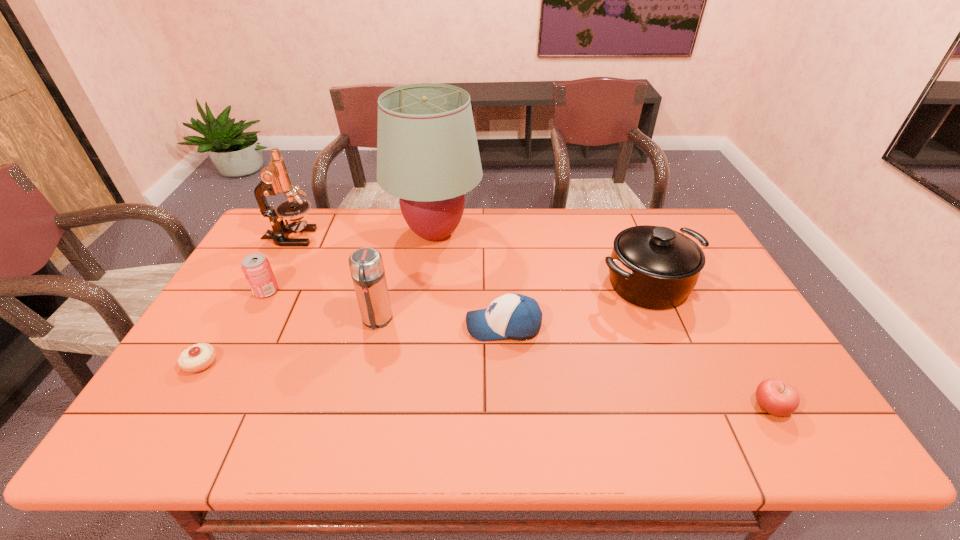
Find the location of `free location located 0.130m on the left of the lampshade`. free location located 0.130m on the left of the lampshade is located at coordinates (349, 233).

Where is `free location located 0.380m at the eyepiece of the seventh shortest object`? Image resolution: width=960 pixels, height=540 pixels. free location located 0.380m at the eyepiece of the seventh shortest object is located at coordinates (431, 237).

This screenshot has height=540, width=960. I want to click on vacant space located 0.100m with a handle on the side of the thermos bottle, so click(366, 365).

At what (x,y) coordinates should I click in order to perform the action: click on vacant space located 0.160m on the left of the saucepan. Please return your answer as a coordinate pair (x, y). Looking at the image, I should click on (541, 284).

Locate an element on the screen. free location located on the back of the soda can is located at coordinates (279, 266).

What are the coordinates of `vacant space located on the front-facing side of the sixth tallest object` in the screenshot? It's located at (325, 326).

Where is `free space located 0.070m on the front-facing side of the sixth tallest object`? free space located 0.070m on the front-facing side of the sixth tallest object is located at coordinates (440, 326).

Locate an element on the screen. This screenshot has width=960, height=540. vacant area situated on the front-facing side of the sixth tallest object is located at coordinates (355, 326).

The height and width of the screenshot is (540, 960). I want to click on vacant space located on the left of the nearest object, so click(x=634, y=406).

Locate an element on the screen. The width and height of the screenshot is (960, 540). vacant area situated on the back of the seventh farthest object is located at coordinates (224, 325).